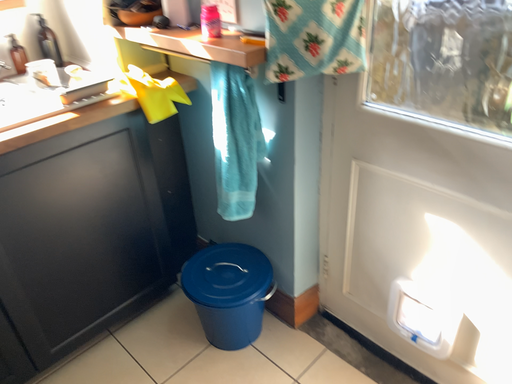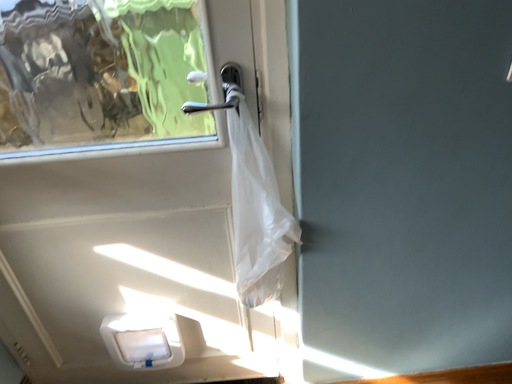
Question: Which way did the camera rotate in the video?

Choices:
 (A) rotated upward
 (B) rotated downward

Answer: (A)